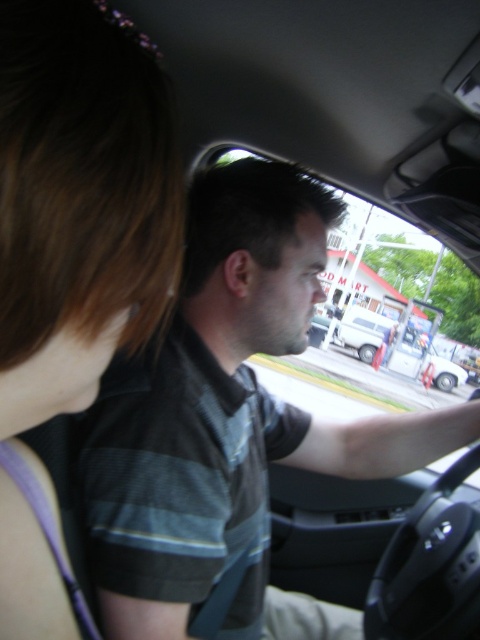
You are a passenger in the car and need to hand a map to the driver. The map is currently on the dashboard. Which object, the dark green striped shirt at center or the brown hair at upper left, is closer to you so you can reach it first?

The dark green striped shirt at center is closer to you because the brown hair at upper left is behind it, so you can reach the dark green striped shirt at center first.

You are sitting in the passenger seat of the car and notice the brown hair at upper left and the white matte van at center. Which object is positioned higher in the image?

The brown hair at upper left is located above the white matte van at center, so it is positioned higher in the image.